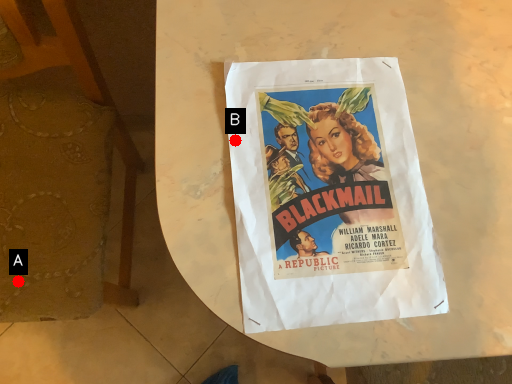
Question: Two points are circled on the image, labeled by A and B beside each circle. Which point is farther from the camera taking this photo?

Choices:
 (A) A is further
 (B) B is further

Answer: (A)